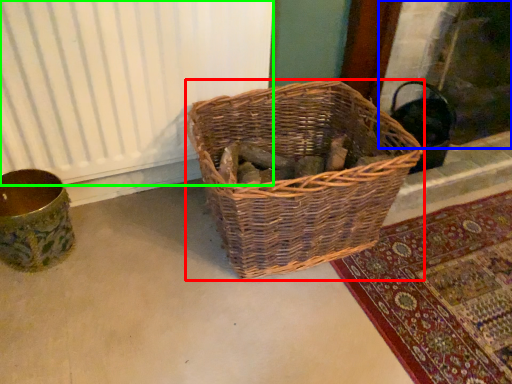
Question: Which is nearer to the picnic basket (highlighted by a red box)? fireplace (highlighted by a blue box) or radiator (highlighted by a green box).

Choices:
 (A) fireplace
 (B) radiator

Answer: (B)